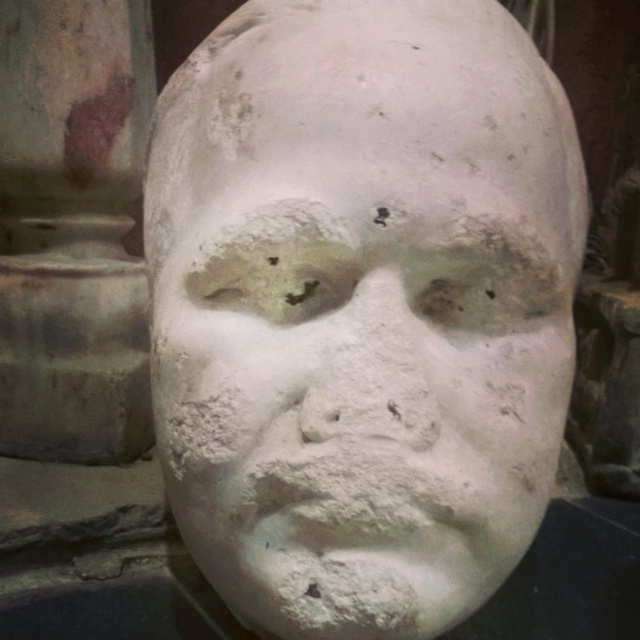
Question: Which object is closer to the camera taking this photo?

Choices:
 (A) white matte plaster at center
 (B) white plaster mask at center

Answer: (B)

Question: Which point is closer to the camera?

Choices:
 (A) (397, 352)
 (B) (461, 227)

Answer: (A)

Question: Is white plaster mask at center closer to camera compared to white matte plaster at center?

Choices:
 (A) no
 (B) yes

Answer: (B)

Question: Is white plaster mask at center bigger than white matte plaster at center?

Choices:
 (A) yes
 (B) no

Answer: (A)

Question: Is white plaster mask at center behind white matte plaster at center?

Choices:
 (A) no
 (B) yes

Answer: (A)